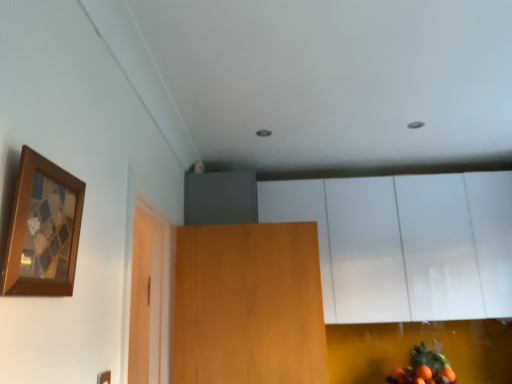
Question: Considering the positions of white glossy cabinet at upper center and wooden picture frame at upper left in the image, is white glossy cabinet at upper center bigger or smaller than wooden picture frame at upper left?

Choices:
 (A) small
 (B) big

Answer: (B)

Question: From the image's perspective, relative to wooden picture frame at upper left, is white glossy cabinet at upper center above or below?

Choices:
 (A) above
 (B) below

Answer: (B)

Question: Which object is the closest to the orange matte fruit at lower right?

Choices:
 (A) white glossy cabinet at upper center
 (B) wooden picture frame at upper left
 (C) wooden door at center

Answer: (A)

Question: Estimate the real-world distances between objects in this image. Which object is closer to the wooden door at center?

Choices:
 (A) orange matte fruit at lower right
 (B) wooden picture frame at upper left
 (C) white glossy cabinet at upper center

Answer: (C)